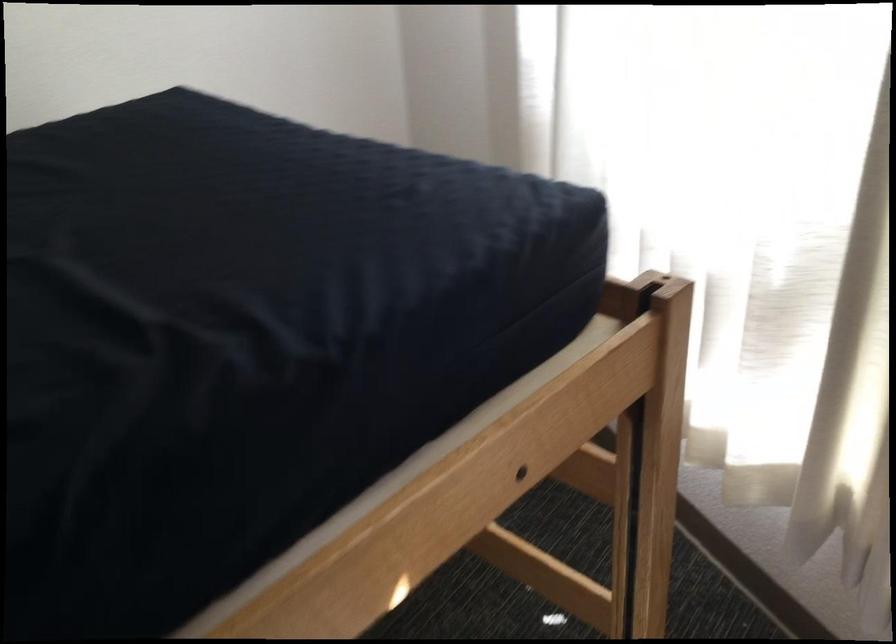
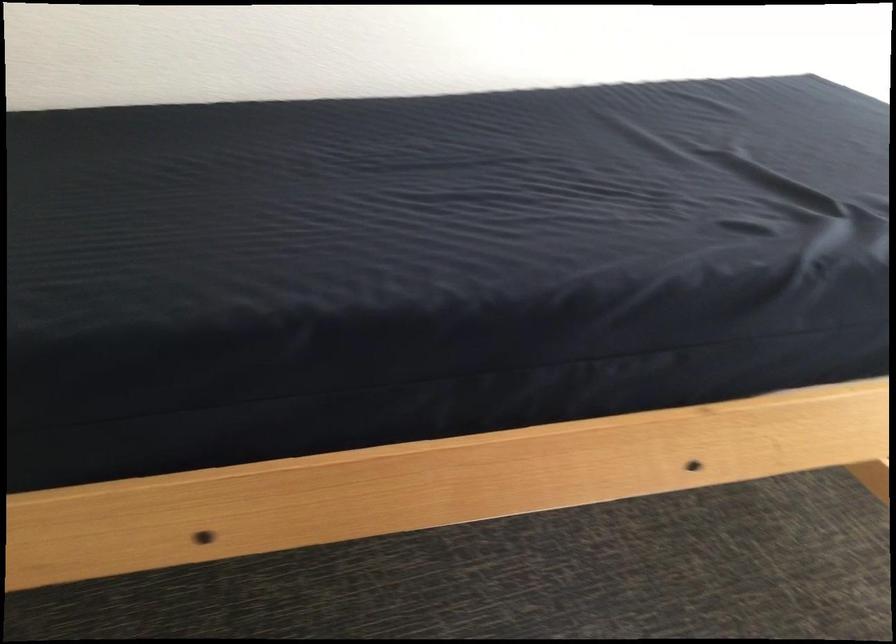
Question: Based on the continuous images, in which direction is the camera rotating? Reply with the corresponding letter.

Choices:
 (A) Left
 (B) Right
 (C) Up
 (D) Down

Answer: (A)